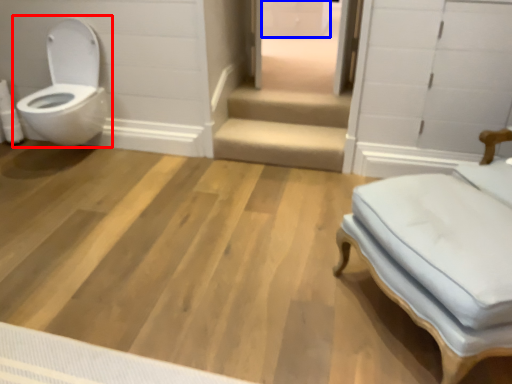
Question: Among these objects, which one is nearest to the camera, toilet (highlighted by a red box) or drawer (highlighted by a blue box)?

Choices:
 (A) toilet
 (B) drawer

Answer: (A)